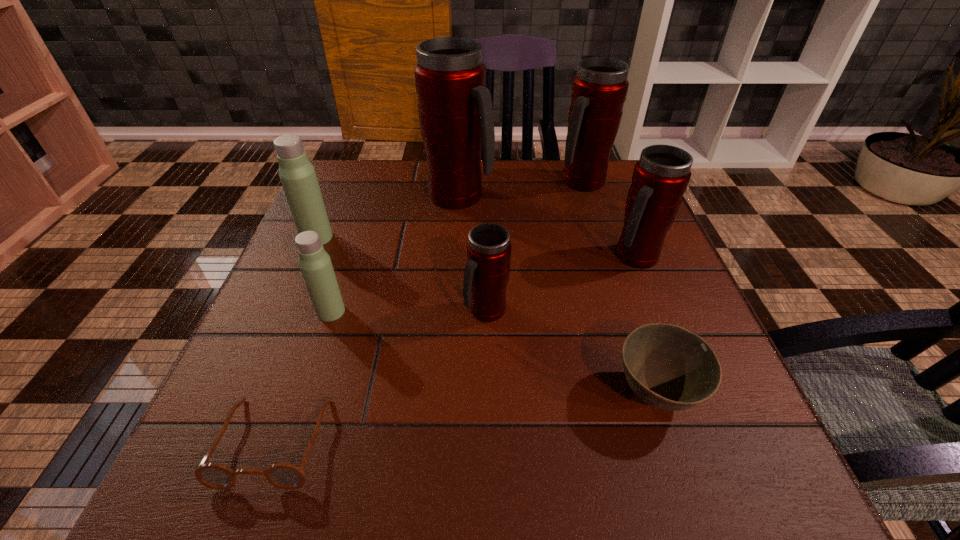
Where is `free space between the bowl and the right light thermos bottle`? free space between the bowl and the right light thermos bottle is located at coordinates (493, 353).

Where is `free space between the second shortest object and the right light thermos bottle`? The width and height of the screenshot is (960, 540). free space between the second shortest object and the right light thermos bottle is located at coordinates (493, 353).

Identify the location of free point between the fifth shortest thermos bottle and the tallest thermos bottle. (520, 189).

This screenshot has height=540, width=960. I want to click on vacant area between the nearer light thermos bottle and the bowl, so coord(493,353).

This screenshot has width=960, height=540. In order to click on free space between the shortest object and the fifth thermos bottle from right to left in this screenshot , I will do `click(302, 376)`.

Where is `vacant area that lies between the shortest object and the smallest red thermos bottle`? Image resolution: width=960 pixels, height=540 pixels. vacant area that lies between the shortest object and the smallest red thermos bottle is located at coordinates (380, 376).

At what (x,y) coordinates should I click in order to perform the action: click on vacant space that's between the nearer light thermos bottle and the seventh tallest object. Please return your answer as a coordinate pair (x, y). Looking at the image, I should click on (493, 353).

You are a GUI agent. You are given a task and a screenshot of the screen. Output one action in this format:
    pyautogui.click(x=<x>, y=<y>)
    Task: Click on the vacant space in between the bowl and the tallest thermos bottle
    The image size is (960, 540).
    Given the screenshot: What is the action you would take?
    pyautogui.click(x=558, y=295)

In order to click on the seventh closest object to the shortest object in this screenshot , I will do coord(599,90).

The height and width of the screenshot is (540, 960). In order to click on object that is the fifth closest to the tallest thermos bottle in this screenshot , I will do `click(315, 264)`.